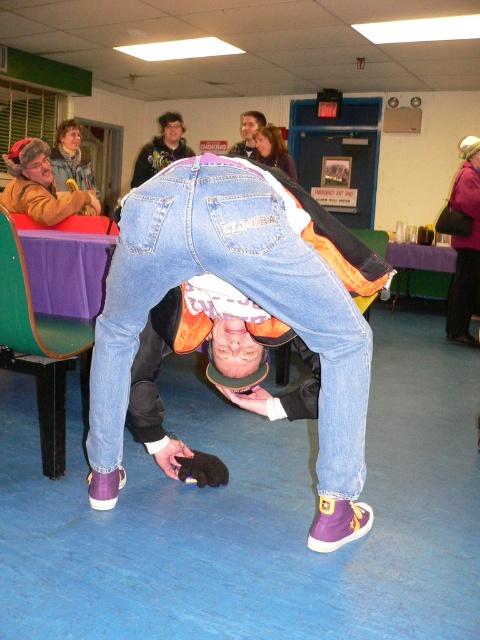
Does denim jeans at center have a greater height compared to dark brown hoodie at upper center?

Yes, denim jeans at center is taller than dark brown hoodie at upper center.

Is denim jeans at center shorter than dark brown hoodie at upper center?

No.

Between point (300, 273) and point (168, 131), which one is positioned in front?

Point (300, 273) is more forward.

Find the location of a particular element. This screenshot has height=640, width=480. denim jeans at center is located at coordinates (237, 289).